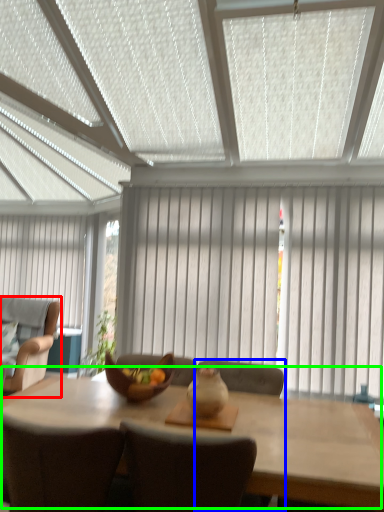
Question: Estimate the real-world distances between objects in this image. Which object is closer to chair (highlighted by a red box), chair (highlighted by a blue box) or kitchen & dining room table (highlighted by a green box)?

Choices:
 (A) chair
 (B) kitchen & dining room table

Answer: (B)